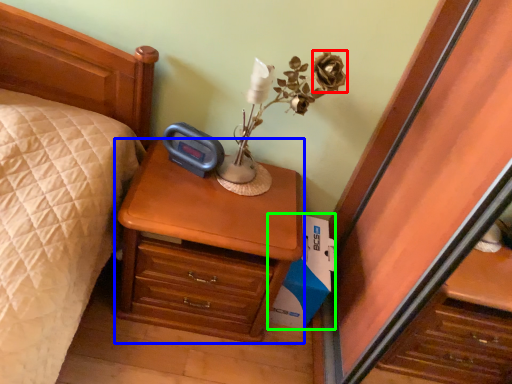
Question: Which object is the closest to the flower (highlighted by a red box)? Choose among these: nightstand (highlighted by a blue box) or cardboard box (highlighted by a green box).

Choices:
 (A) nightstand
 (B) cardboard box

Answer: (A)